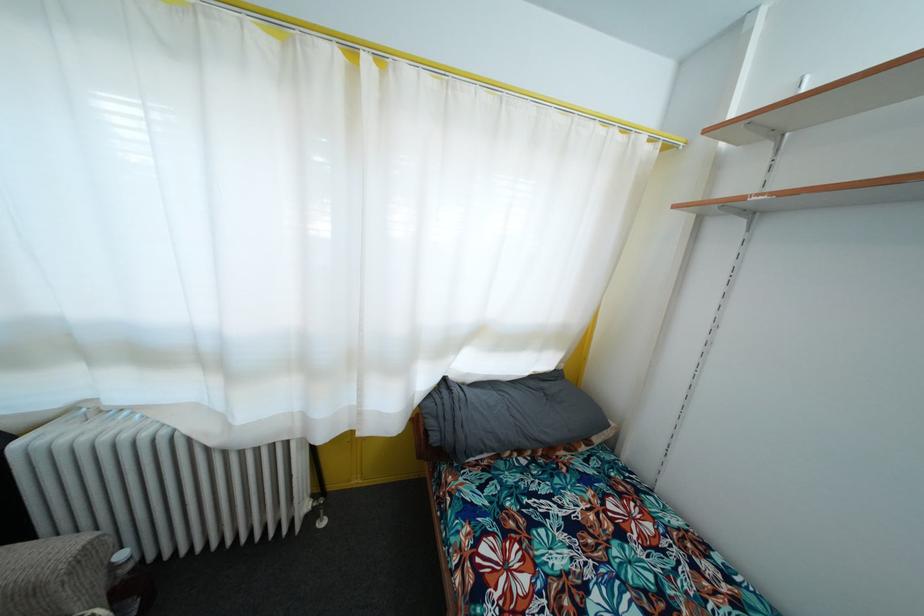
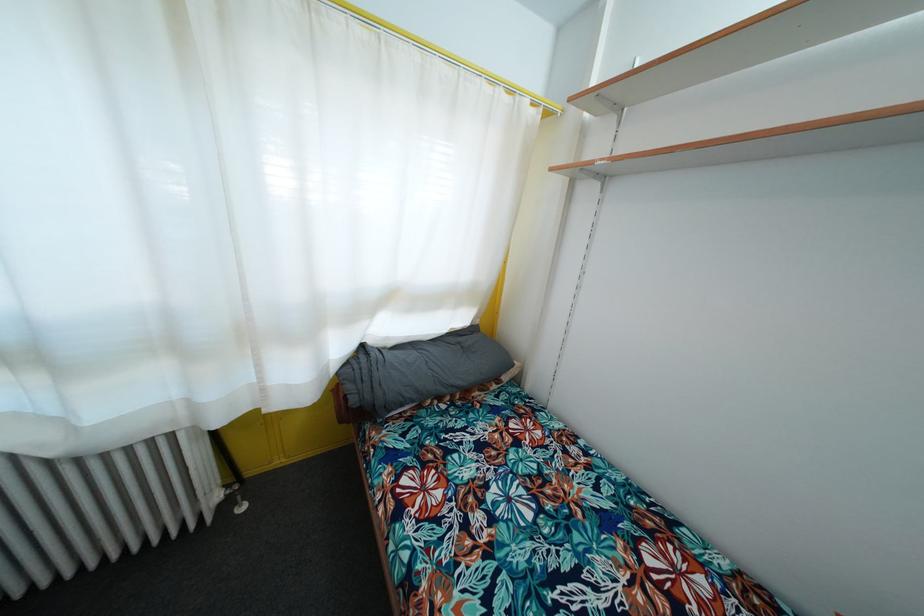
Find the pixel in the second image that matches (322,524) in the first image.

(240, 511)